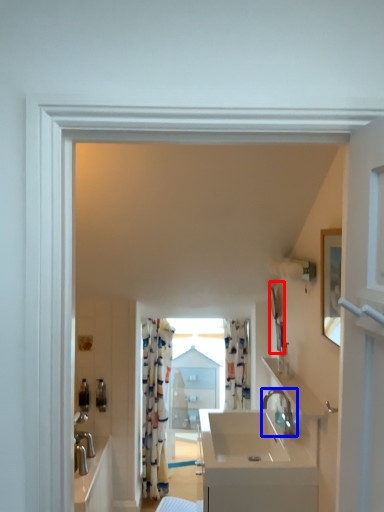
Question: Which point is further to the camera, mirror (highlighted by a red box) or tap (highlighted by a blue box)?

Choices:
 (A) mirror
 (B) tap

Answer: (A)